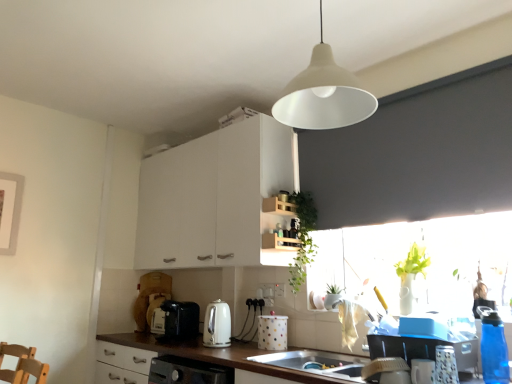
Question: Does transparent glass window at right have a lesser height compared to white matte cabinet at upper center?

Choices:
 (A) yes
 (B) no

Answer: (A)

Question: Does transparent glass window at right contain white matte cabinet at upper center?

Choices:
 (A) yes
 (B) no

Answer: (B)

Question: Is transparent glass window at right to the left of white matte cabinet at upper center from the viewer's perspective?

Choices:
 (A) yes
 (B) no

Answer: (B)

Question: Is transparent glass window at right positioned with its back to white matte cabinet at upper center?

Choices:
 (A) no
 (B) yes

Answer: (A)

Question: Is the depth of transparent glass window at right less than that of white matte cabinet at upper center?

Choices:
 (A) no
 (B) yes

Answer: (B)

Question: Is white plastic dish brush at lower right, positioned as the fourth appliance in back-to-front order, situated inside white plastic electric outlet at center, the 1th electric outlet viewed from the right, or outside?

Choices:
 (A) inside
 (B) outside

Answer: (B)

Question: In the image, is white plastic dish brush at lower right, which ranks as the fourth appliance in front-to-back order, positioned in front of or behind white plastic electric outlet at center, the 1th electric outlet viewed from the right?

Choices:
 (A) behind
 (B) front

Answer: (B)

Question: From a real-world perspective, is white plastic dish brush at lower right, which ranks as the fifth appliance in right-to-left order, positioned above or below white plastic electric outlet at center, the first electric outlet when ordered from front to back?

Choices:
 (A) above
 (B) below

Answer: (B)

Question: Visually, is white plastic dish brush at lower right, arranged as the third appliance when viewed from the left, positioned to the left or to the right of white plastic electric outlet at center, the second electric outlet from the back?

Choices:
 (A) left
 (B) right

Answer: (B)

Question: Looking at the image, does wooden shelf at center seem bigger or smaller compared to white polka dot container at lower center, acting as the 6th appliance starting from the right?

Choices:
 (A) big
 (B) small

Answer: (A)

Question: Is point (271, 264) positioned closer to the camera than point (268, 345)?

Choices:
 (A) closer
 (B) farther

Answer: (B)

Question: Is wooden shelf at center to the left or to the right of white polka dot container at lower center, the 6th appliance from the front, in the image?

Choices:
 (A) left
 (B) right

Answer: (B)

Question: From a real-world perspective, is wooden shelf at center physically located above or below white polka dot container at lower center, the 6th appliance from the front?

Choices:
 (A) above
 (B) below

Answer: (A)

Question: Considering their positions, is wooden shelf at center located in front of or behind white plastic electric outlet at center, the 2th electric outlet when ordered from left to right?

Choices:
 (A) behind
 (B) front

Answer: (B)

Question: Visually, is wooden shelf at center positioned to the left or to the right of white plastic electric outlet at center, the second electric outlet from the back?

Choices:
 (A) left
 (B) right

Answer: (B)